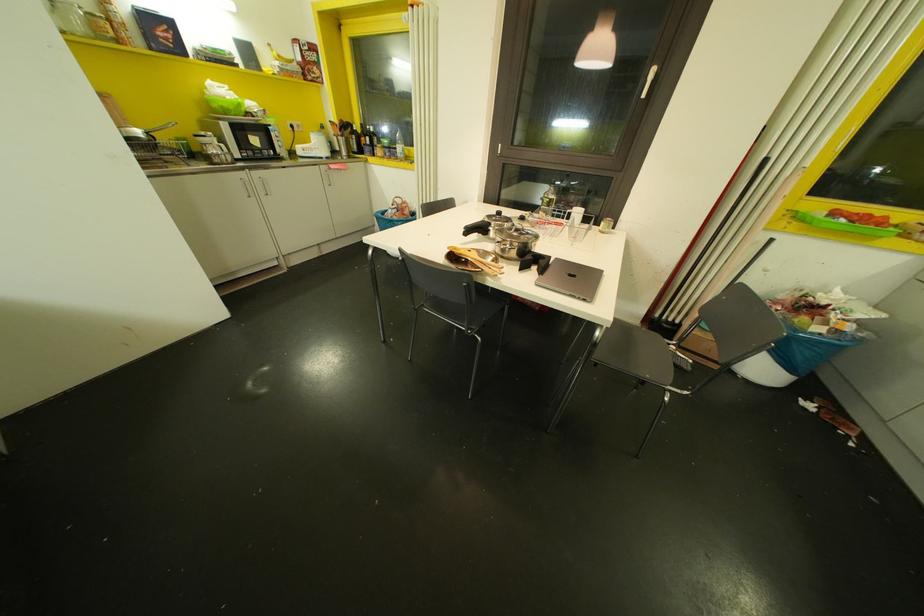
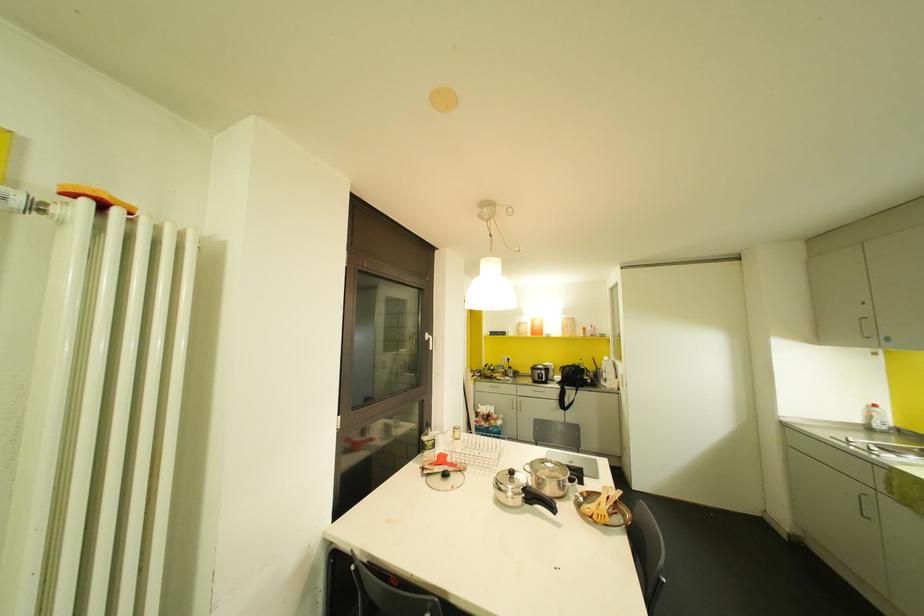
Find the pixel in the second image that matches point (641, 95) in the first image.

(430, 347)